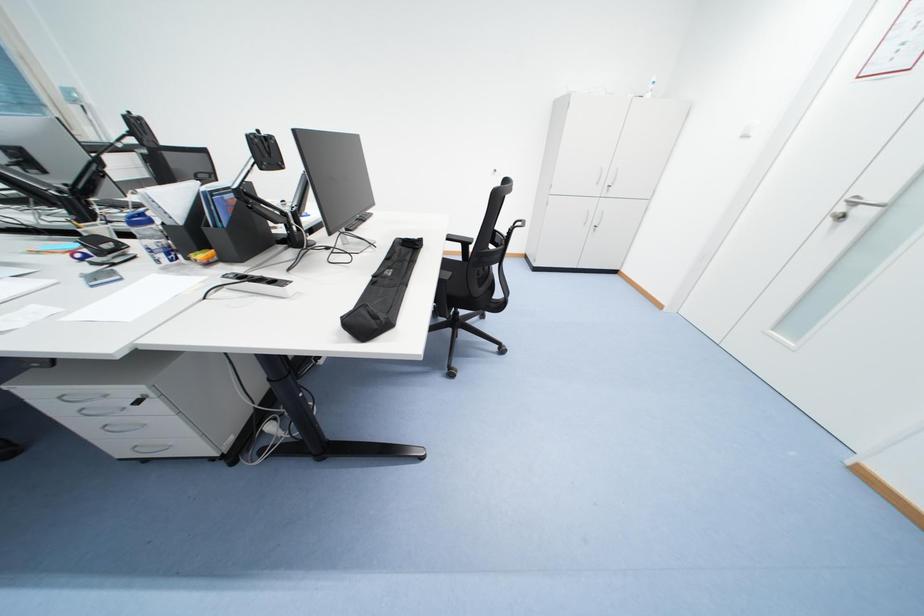
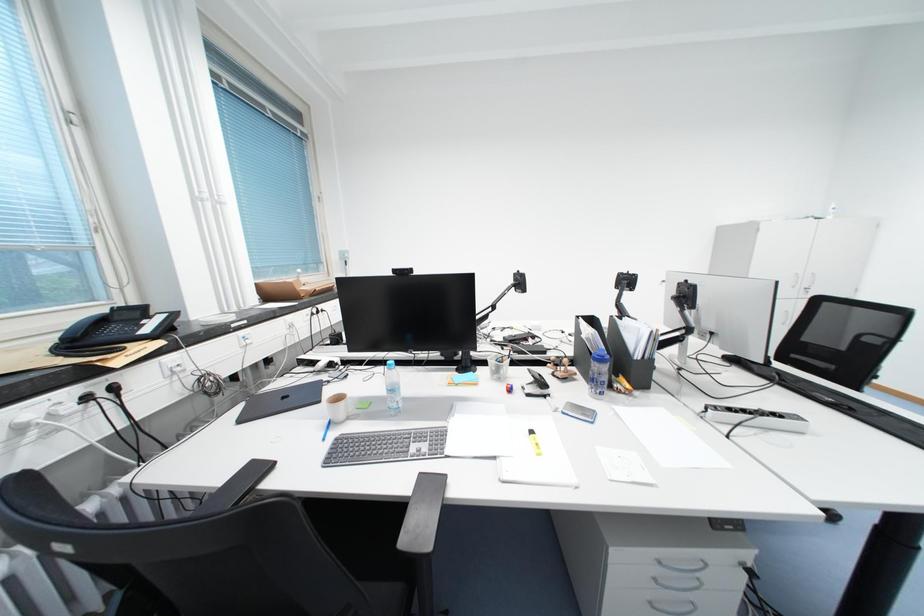
Question: In a continuous first-person perspective shot, in which direction is the camera moving?

Choices:
 (A) Left
 (B) Right
 (C) Forward
 (D) Backward

Answer: (A)